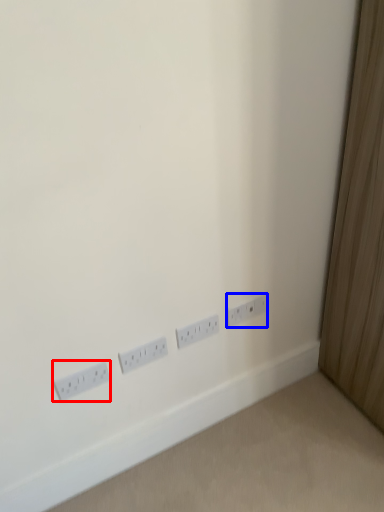
Question: Which point is further to the camera, power plugs and sockets (highlighted by a red box) or power plugs and sockets (highlighted by a blue box)?

Choices:
 (A) power plugs and sockets
 (B) power plugs and sockets

Answer: (B)